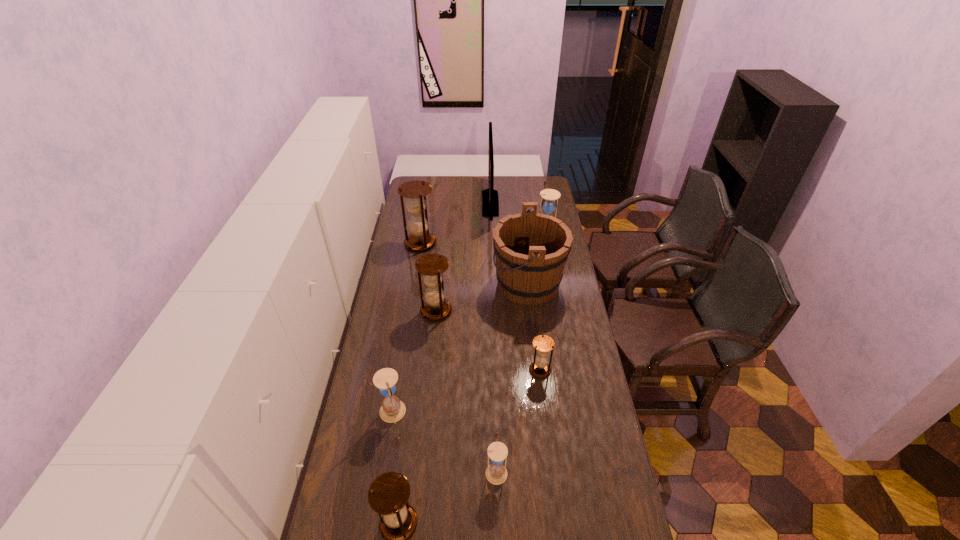
In the image, there is a desktop. Where is `free space at the far right corner`? Image resolution: width=960 pixels, height=540 pixels. free space at the far right corner is located at coordinates (543, 189).

Locate an element on the screen. This screenshot has height=540, width=960. vacant area that lies between the sixth farthest hourglass and the tallest hourglass is located at coordinates (459, 357).

Locate an element on the screen. Image resolution: width=960 pixels, height=540 pixels. vacant area that lies between the monitor and the tallest hourglass is located at coordinates (455, 223).

What are the coordinates of `free spot between the third farthest hourglass and the second nearest brown hourglass` in the screenshot? It's located at (488, 341).

Image resolution: width=960 pixels, height=540 pixels. What are the coordinates of `object that is the eighth nearest to the second farthest brown hourglass` in the screenshot? It's located at (388, 495).

The image size is (960, 540). What are the coordinates of `object that ranks as the third closest to the wine bucket` in the screenshot? It's located at (490, 202).

Identify which hourglass is located as the fourth nearest to the biggest brown hourglass. Please provide its 2D coordinates. Your answer should be formatted as a tuple, i.e. [(x, y)], where the tuple contains the x and y coordinates of a point satisfying the conditions above.

[(392, 410)]

Where is `hourglass that is the closest to the farthest brown hourglass`? hourglass that is the closest to the farthest brown hourglass is located at coordinates (432, 266).

The image size is (960, 540). I want to click on brown hourglass identified as the third closest to the nearest brown hourglass, so click(x=416, y=191).

This screenshot has height=540, width=960. I want to click on the fourth closest brown hourglass to the third nearest object, so click(416, 191).